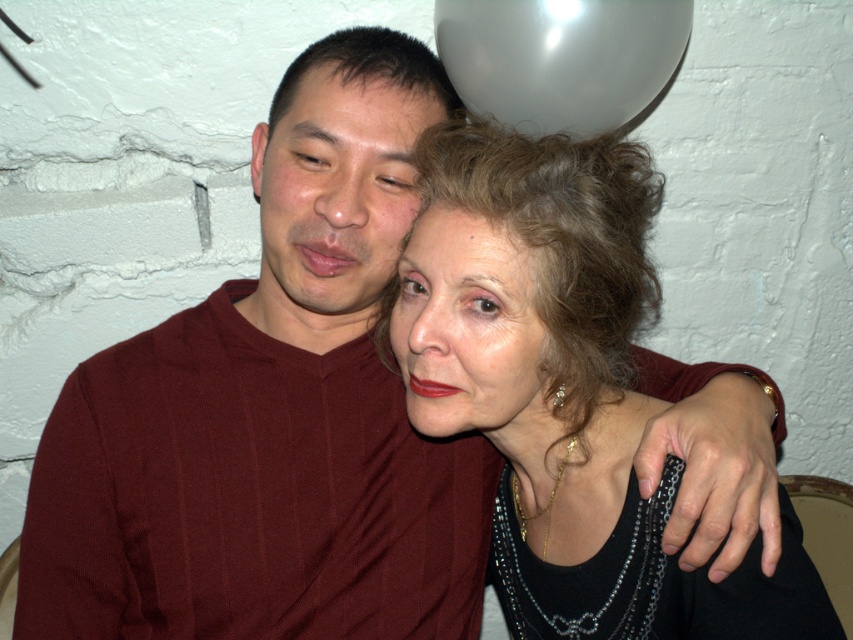
Question: Which of the following is the closest to the observer?

Choices:
 (A) matte black necklace at center
 (B) white glossy balloon at upper center
 (C) matte red shirt at left

Answer: (A)

Question: Which object is closer to the camera taking this photo?

Choices:
 (A) white glossy balloon at upper center
 (B) matte red shirt at left
 (C) matte black forehead at upper center
 (D) matte black face at center

Answer: (D)

Question: Does matte red shirt at left have a greater width compared to matte black face at center?

Choices:
 (A) no
 (B) yes

Answer: (B)

Question: Is matte black necklace at center below matte black forehead at upper center?

Choices:
 (A) no
 (B) yes

Answer: (B)

Question: Which point is closer to the camera?

Choices:
 (A) (459, 218)
 (B) (312, 145)

Answer: (A)

Question: Considering the relative positions of matte red shirt at left and matte black forehead at upper center in the image provided, where is matte red shirt at left located with respect to matte black forehead at upper center?

Choices:
 (A) right
 (B) left

Answer: (B)